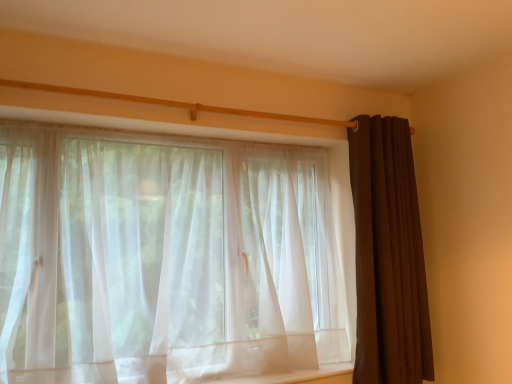
Question: From the image's perspective, is sheer white curtain at center, the first curtain in the left-to-right sequence, located above or below brown textured curtain at right, which ranks as the 1th curtain in right-to-left order?

Choices:
 (A) above
 (B) below

Answer: (B)

Question: Is point click(292, 157) closer or farther from the camera than point click(385, 271)?

Choices:
 (A) closer
 (B) farther

Answer: (B)

Question: Considering the relative positions of sheer white curtain at center, the first curtain in the left-to-right sequence, and brown textured curtain at right, which ranks as the 1th curtain in right-to-left order, in the image provided, is sheer white curtain at center, the first curtain in the left-to-right sequence, to the left or to the right of brown textured curtain at right, which ranks as the 1th curtain in right-to-left order,?

Choices:
 (A) right
 (B) left

Answer: (B)

Question: Relative to sheer white curtain at center, the first curtain in the left-to-right sequence, is brown textured curtain at right, which ranks as the 1th curtain in right-to-left order, in front or behind?

Choices:
 (A) front
 (B) behind

Answer: (B)

Question: Considering the relative positions of brown textured curtain at right, marked as the 2th curtain in a left-to-right arrangement, and sheer white curtain at center, the first curtain in the left-to-right sequence, in the image provided, is brown textured curtain at right, marked as the 2th curtain in a left-to-right arrangement, to the left or to the right of sheer white curtain at center, the first curtain in the left-to-right sequence,?

Choices:
 (A) left
 (B) right

Answer: (B)

Question: From a real-world perspective, relative to sheer white curtain at center, the 2th curtain positioned from the right, is brown textured curtain at right, which ranks as the 1th curtain in right-to-left order, vertically above or below?

Choices:
 (A) above
 (B) below

Answer: (A)

Question: Would you say brown textured curtain at right, which ranks as the 1th curtain in right-to-left order, is inside or outside sheer white curtain at center, the 2th curtain positioned from the right?

Choices:
 (A) inside
 (B) outside

Answer: (B)